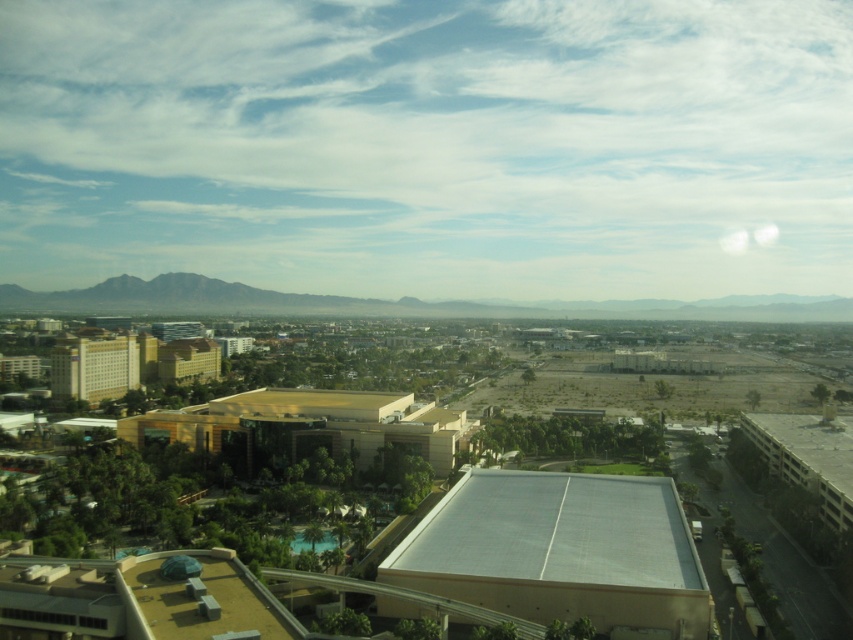
You are a city planner analyzing the urban layout. Based on the scene, which structure occupies more horizontal space from your viewpoint? The gray concrete parking garage at lower right or the beige concrete building at center?

The gray concrete parking garage at lower right might be wider than beige concrete building at center, so it likely occupies more horizontal space from your viewpoint.

You are standing at the center of the image and want to walk towards the beige concrete hotel at left. Which direction should you walk to avoid the gray concrete parking garage at lower right?

You should walk to the left side of the beige concrete hotel at left to avoid the gray concrete parking garage at lower right, which is positioned on the right side of it.